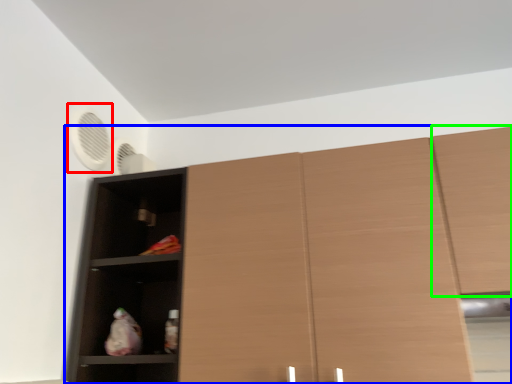
Question: Estimate the real-world distances between objects in this image. Which object is farther from fan (highlighted by a red box), cupboard (highlighted by a blue box) or cabinetry (highlighted by a green box)?

Choices:
 (A) cupboard
 (B) cabinetry

Answer: (B)